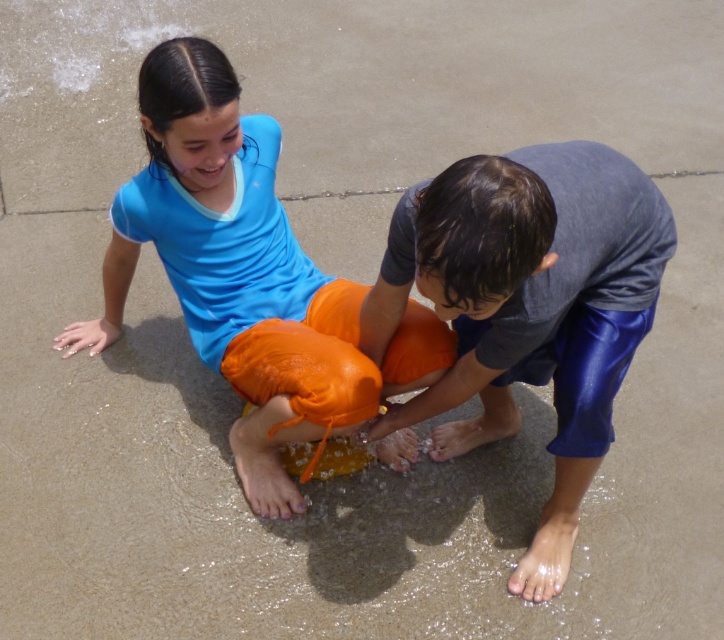
Question: Can you confirm if blue shiny shorts at lower right is positioned above matte blue shirt at upper left?

Choices:
 (A) yes
 (B) no

Answer: (B)

Question: Which point is farther to the camera?

Choices:
 (A) (298, 282)
 (B) (502, 317)

Answer: (A)

Question: Is blue shiny shorts at lower right smaller than matte blue shirt at upper left?

Choices:
 (A) yes
 (B) no

Answer: (A)

Question: Can you confirm if blue shiny shorts at lower right is thinner than matte blue shirt at upper left?

Choices:
 (A) yes
 (B) no

Answer: (A)